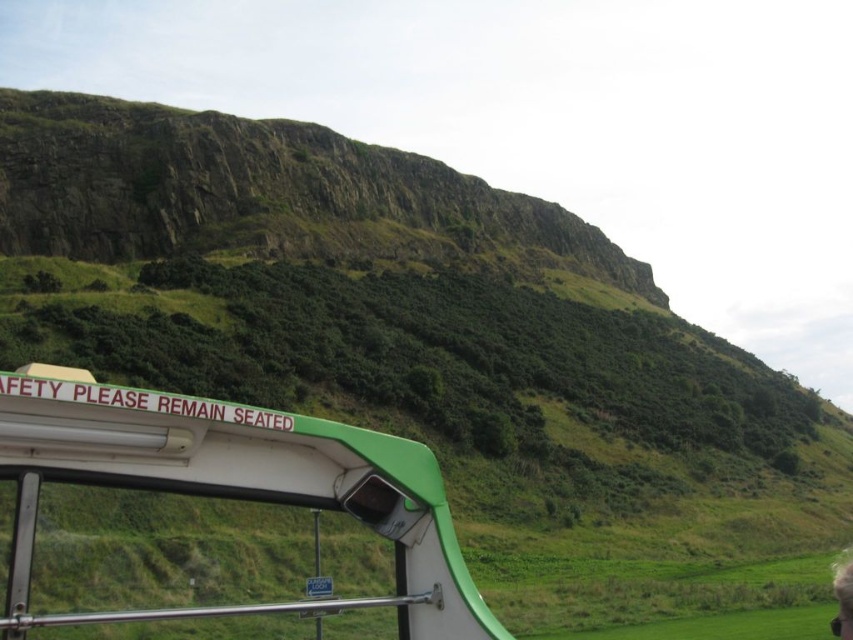
Question: Is the position of green plastic tour bus at lower left more distant than that of smooth skin person at lower right?

Choices:
 (A) no
 (B) yes

Answer: (A)

Question: Does green plastic tour bus at lower left come behind smooth skin person at lower right?

Choices:
 (A) yes
 (B) no

Answer: (B)

Question: Among these objects, which one is farthest from the camera?

Choices:
 (A) green plastic tour bus at lower left
 (B) smooth skin person at lower right

Answer: (B)

Question: Can you confirm if green plastic tour bus at lower left is positioned below smooth skin person at lower right?

Choices:
 (A) no
 (B) yes

Answer: (A)

Question: Which of the following is the closest to the observer?

Choices:
 (A) (419, 480)
 (B) (851, 636)

Answer: (A)

Question: Which of the following is the farthest from the observer?

Choices:
 (A) green plastic tour bus at lower left
 (B) smooth skin person at lower right

Answer: (B)